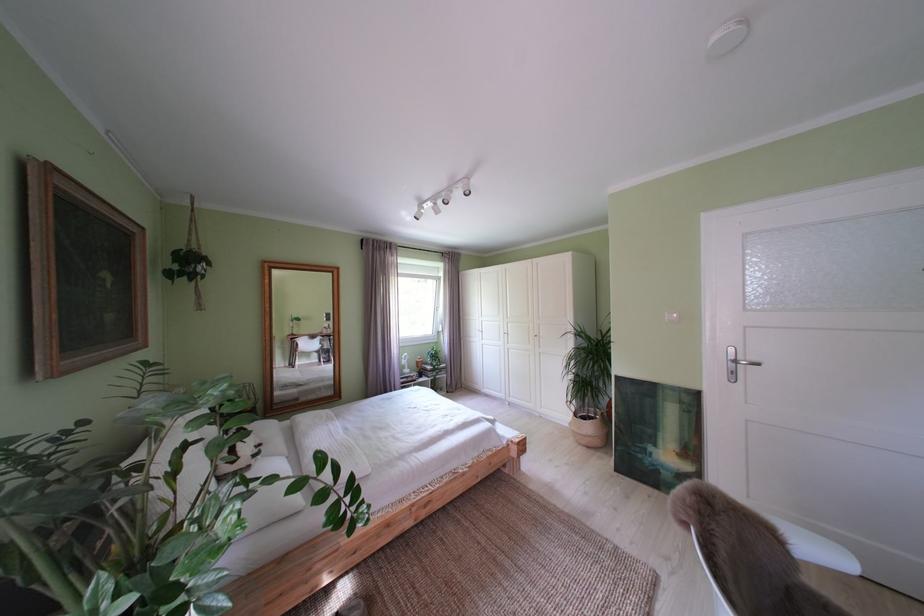
Find where to push the white light switch. Please return your answer as a coordinate pair (x, y).

(672, 315)